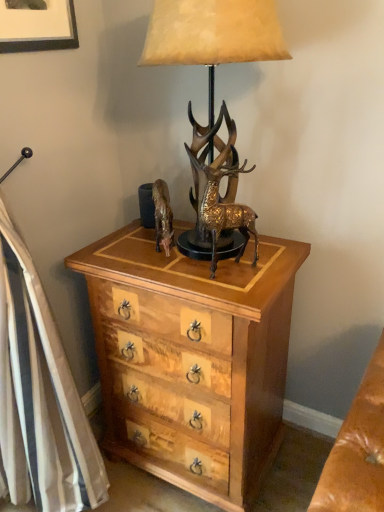
Question: Does gold metallic horse at center have a lesser height compared to gold textured deer at center?

Choices:
 (A) yes
 (B) no

Answer: (A)

Question: Can you confirm if gold metallic horse at center is thinner than gold textured deer at center?

Choices:
 (A) no
 (B) yes

Answer: (A)

Question: From the image's perspective, would you say gold metallic horse at center is positioned over gold textured deer at center?

Choices:
 (A) no
 (B) yes

Answer: (B)

Question: Is gold metallic horse at center completely or partially outside of gold textured deer at center?

Choices:
 (A) no
 (B) yes

Answer: (B)

Question: From a real-world perspective, is gold metallic horse at center physically above gold textured deer at center?

Choices:
 (A) yes
 (B) no

Answer: (B)

Question: Does gold metallic horse at center have a greater height compared to gold textured deer at center?

Choices:
 (A) yes
 (B) no

Answer: (B)

Question: Are matte black picture frame at upper left and gold metallic horse at center far apart?

Choices:
 (A) yes
 (B) no

Answer: (B)

Question: Is matte black picture frame at upper left taller than gold metallic horse at center?

Choices:
 (A) no
 (B) yes

Answer: (B)

Question: Does matte black picture frame at upper left have a lesser width compared to gold metallic horse at center?

Choices:
 (A) no
 (B) yes

Answer: (B)

Question: Considering the relative positions of matte black picture frame at upper left and gold metallic horse at center in the image provided, is matte black picture frame at upper left behind gold metallic horse at center?

Choices:
 (A) no
 (B) yes

Answer: (A)

Question: From a real-world perspective, does matte black picture frame at upper left sit lower than gold metallic horse at center?

Choices:
 (A) no
 (B) yes

Answer: (A)

Question: From the image's perspective, is matte black picture frame at upper left located above gold metallic horse at center?

Choices:
 (A) yes
 (B) no

Answer: (A)

Question: Is gold textured deer at center at the back of matte black picture frame at upper left?

Choices:
 (A) yes
 (B) no

Answer: (B)